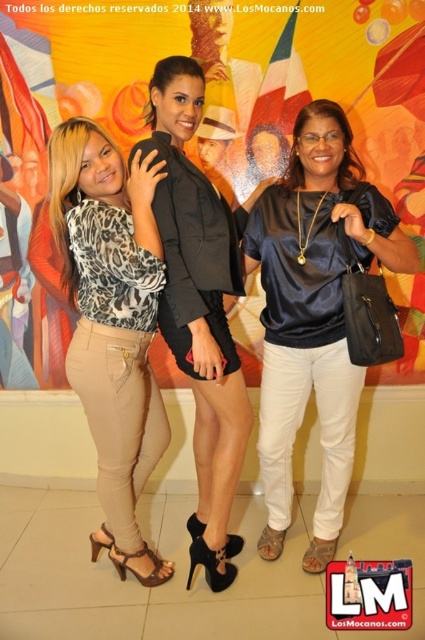
Is point (20, 124) positioned before point (297, 195)?

No, it is not.

Is matte black blazer at center taller than satin black blouse at center?

Incorrect, matte black blazer at center's height is not larger of satin black blouse at center's.

Does point (153, 64) lie in front of point (331, 362)?

No, (153, 64) is further to viewer.

Where is `matte black blazer at center`? This screenshot has width=425, height=640. matte black blazer at center is located at coordinates (201, 120).

Is point (23, 240) closer to viewer compared to point (146, 577)?

That is False.

Who is more forward, (238, 339) or (87, 168)?

Positioned in front is point (87, 168).

At what (x,y) coordinates should I click in order to perform the action: click on matte black blazer at center. Please return your answer as a coordinate pair (x, y). Image resolution: width=425 pixels, height=640 pixels. Looking at the image, I should click on (201, 120).

How distant is satin black blouse at center from leopard print blouse at left?

A distance of 60.71 centimeters exists between satin black blouse at center and leopard print blouse at left.

Does satin black blouse at center appear over leopard print blouse at left?

Yes, satin black blouse at center is above leopard print blouse at left.

I want to click on satin black blouse at center, so click(314, 316).